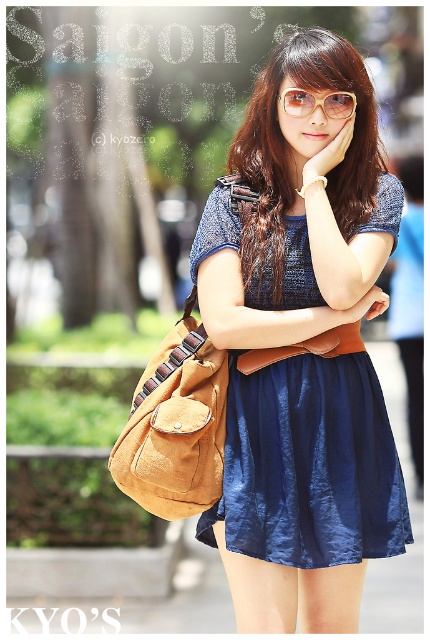
Question: Considering the real-world distances, which object is farthest from the translucent yellow plastic glasses at upper center?

Choices:
 (A) suede brown shoulder bag at center
 (B) blue satin dress at center
 (C) satin blue skirt at center
 (D) matte blue dress at center

Answer: (C)

Question: Estimate the real-world distances between objects in this image. Which object is closer to the satin blue skirt at center?

Choices:
 (A) suede brown shoulder bag at center
 (B) blue satin dress at center
 (C) translucent yellow plastic glasses at upper center

Answer: (B)

Question: Can you confirm if blue satin dress at center is positioned above matte blue dress at center?

Choices:
 (A) no
 (B) yes

Answer: (A)

Question: Is matte blue dress at center smaller than suede brown shoulder bag at center?

Choices:
 (A) yes
 (B) no

Answer: (B)

Question: Which point is closer to the camera?

Choices:
 (A) blue satin dress at center
 (B) matte blue dress at center
 (C) satin blue skirt at center
 (D) suede brown shoulder bag at center

Answer: (D)

Question: Where is blue satin dress at center located in relation to satin blue skirt at center in the image?

Choices:
 (A) left
 (B) right

Answer: (A)